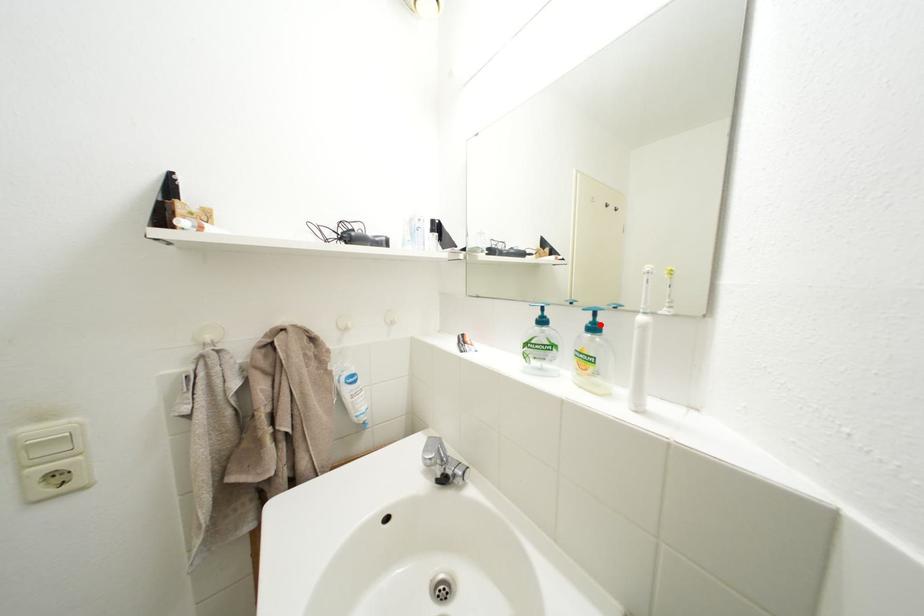
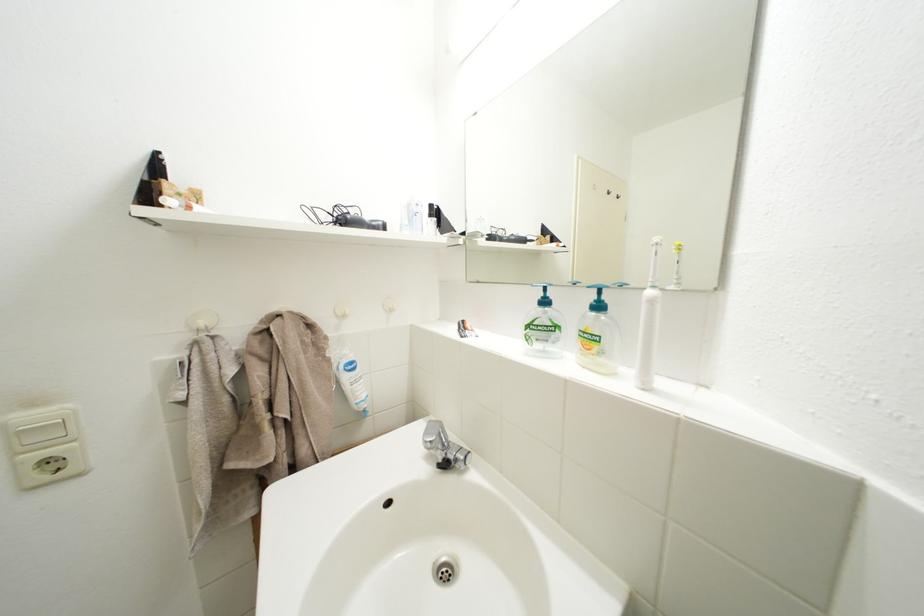
Where in the second image is the point corresponding to the highlighted location from the first image?

(604, 302)